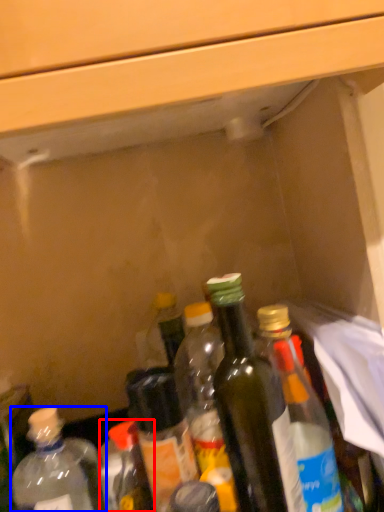
Question: Among these objects, which one is farthest to the camera, bottle (highlighted by a red box) or bottle (highlighted by a blue box)?

Choices:
 (A) bottle
 (B) bottle

Answer: (A)